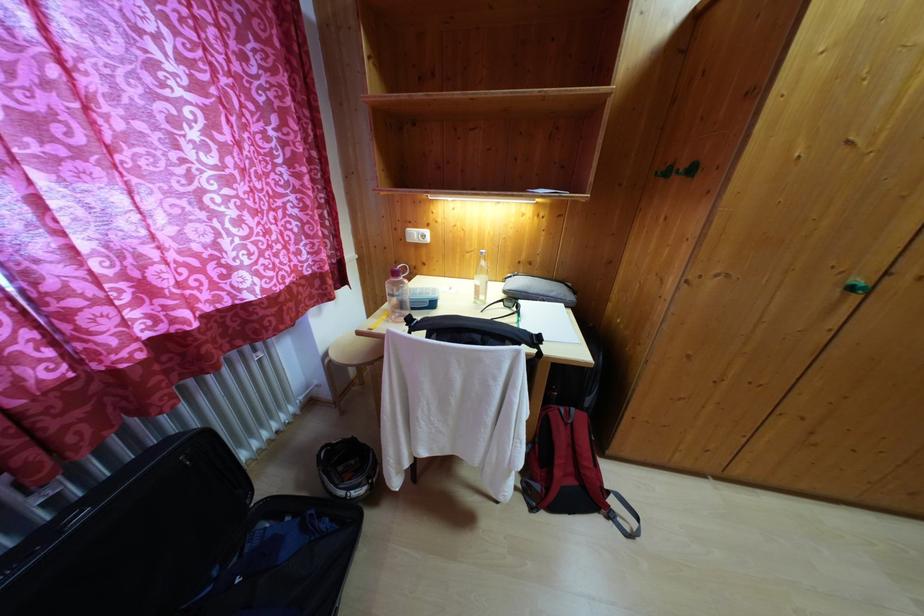
Find where to twist the red bottle cap. Please return your answer as a coordinate pair (x, y).

(397, 293)